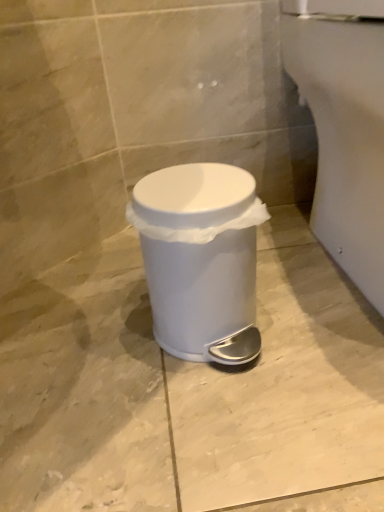
Question: Considering the relative sizes of white glossy porcelain at lower right and white plastic waste container at center in the image provided, is white glossy porcelain at lower right bigger than white plastic waste container at center?

Choices:
 (A) no
 (B) yes

Answer: (B)

Question: Is white glossy porcelain at lower right oriented towards white plastic waste container at center?

Choices:
 (A) no
 (B) yes

Answer: (A)

Question: Is white plastic waste container at center a part of white glossy porcelain at lower right?

Choices:
 (A) no
 (B) yes

Answer: (A)

Question: Would you consider white glossy porcelain at lower right to be distant from white plastic waste container at center?

Choices:
 (A) no
 (B) yes

Answer: (A)

Question: Is white glossy porcelain at lower right shorter than white plastic waste container at center?

Choices:
 (A) yes
 (B) no

Answer: (B)

Question: Is white glossy porcelain at lower right next to white plastic waste container at center?

Choices:
 (A) no
 (B) yes

Answer: (A)

Question: From a real-world perspective, is white plastic waste container at center located higher than white glossy porcelain at lower right?

Choices:
 (A) no
 (B) yes

Answer: (A)

Question: Would you say white plastic waste container at center is outside white glossy porcelain at lower right?

Choices:
 (A) no
 (B) yes

Answer: (B)

Question: Does white plastic waste container at center contain white glossy porcelain at lower right?

Choices:
 (A) yes
 (B) no

Answer: (B)

Question: From the image's perspective, is white plastic waste container at center beneath white glossy porcelain at lower right?

Choices:
 (A) yes
 (B) no

Answer: (A)

Question: Is white glossy porcelain at lower right at the back of white plastic waste container at center?

Choices:
 (A) yes
 (B) no

Answer: (B)

Question: Is white plastic waste container at center behind white glossy porcelain at lower right?

Choices:
 (A) no
 (B) yes

Answer: (B)

Question: Considering their positions, is white glossy porcelain at lower right located in front of or behind white plastic waste container at center?

Choices:
 (A) front
 (B) behind

Answer: (A)